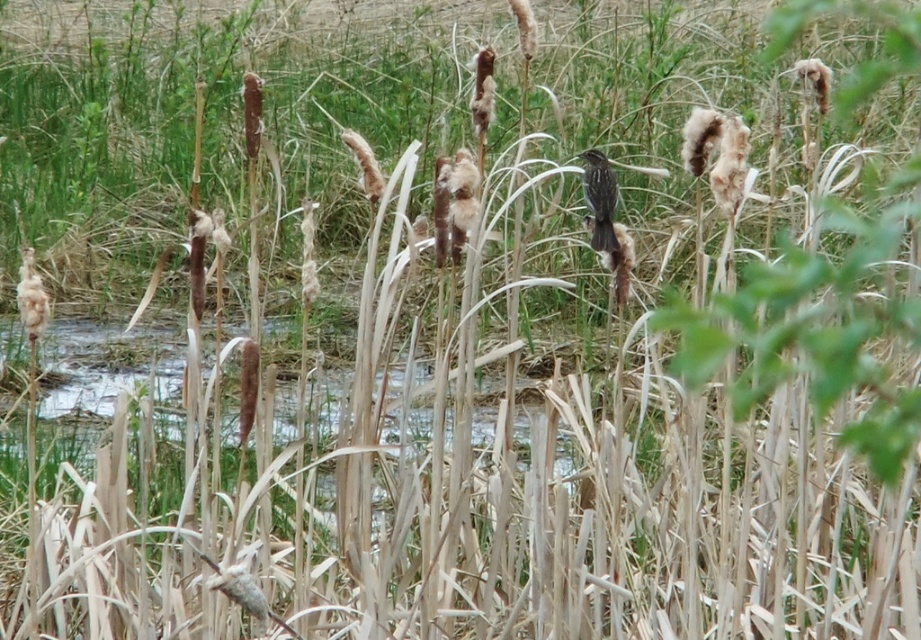
Does brown speckled bird at center have a lesser height compared to fuzzy brown reed at left?

No, brown speckled bird at center is not shorter than fuzzy brown reed at left.

What do you see at coordinates (600, 200) in the screenshot?
I see `brown speckled bird at center` at bounding box center [600, 200].

Image resolution: width=921 pixels, height=640 pixels. I want to click on brown speckled bird at center, so click(600, 200).